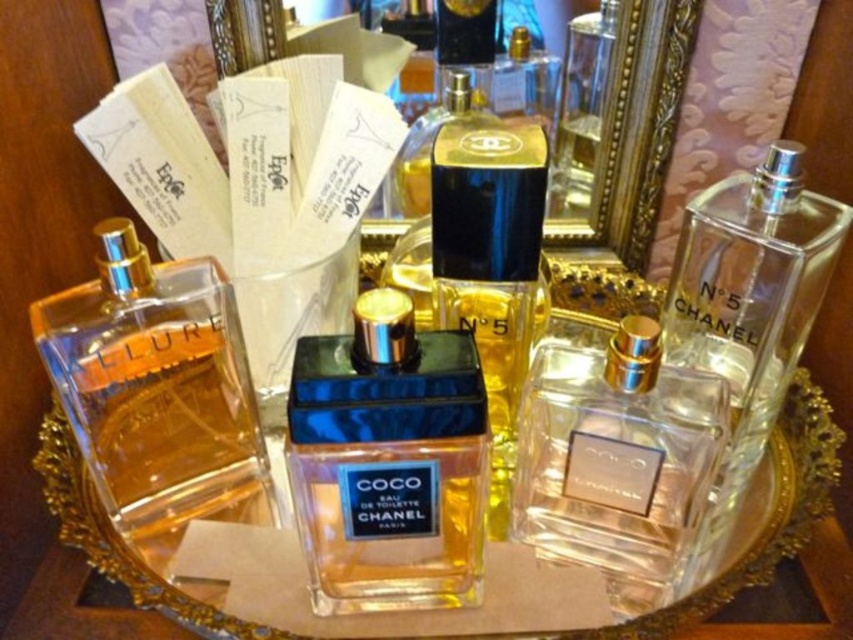
You are a perfumer arranging bottles on a tray. You have a shiny blue glass perfume at center and a clear glass bottle at left. You need to place a decorative ribbon between them. How far apart should you place the ribbon from each bottle to center it?

The shiny blue glass perfume at center and clear glass bottle at left are 5.78 inches apart. To center the ribbon between them, place it 2.89 inches from each bottle.

What are the coordinates of the clear glass bottle at left?

The clear glass bottle at left is located at coordinates point (154, 385).